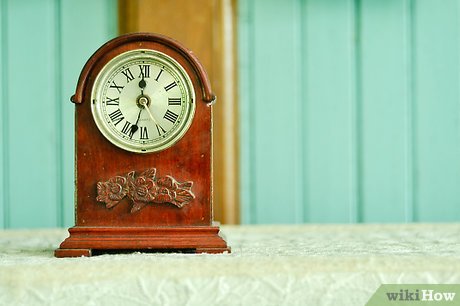
This screenshot has width=460, height=306. I want to click on clock hands, so click(x=151, y=112), click(x=137, y=114), click(x=142, y=85).